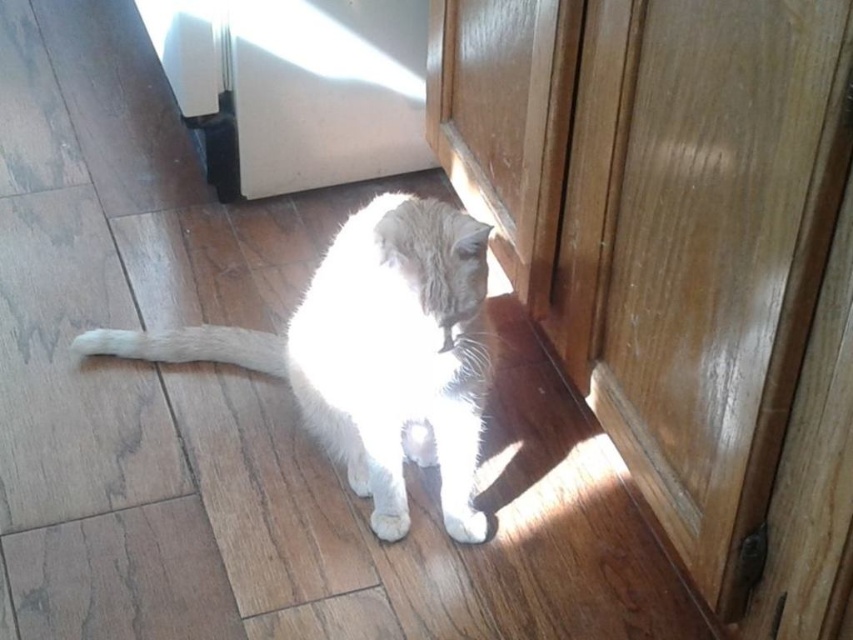
You are a photographer trying to capture the white fluffy cat at center and the white fur paw at lower center in a single shot. Based on their positions, which object should you adjust your camera angle to focus on first to ensure both are in frame?

The white fluffy cat at center is to the left of white fur paw at lower center, so you should adjust your camera angle to focus on the white fluffy cat at center first to ensure both are in frame.